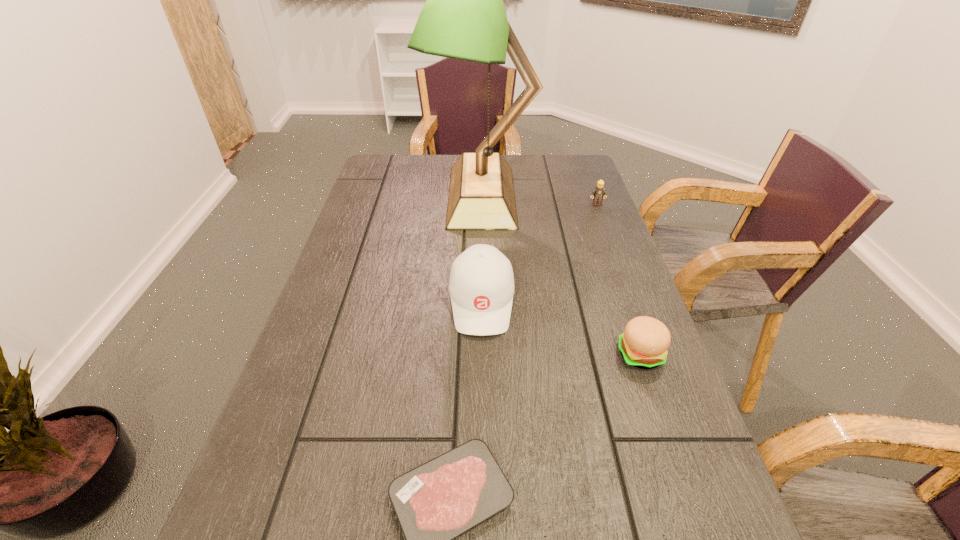
This screenshot has height=540, width=960. Identify the location of table lamp. (464, 17).

Where is `baseball cap`? The image size is (960, 540). baseball cap is located at coordinates (481, 286).

At what (x,y) coordinates should I click in order to perform the action: click on hamburger. Please return your answer as a coordinate pair (x, y). The height and width of the screenshot is (540, 960). Looking at the image, I should click on (643, 344).

At what (x,y) coordinates should I click in order to perform the action: click on Lego. Please return your answer as a coordinate pair (x, y). Image resolution: width=960 pixels, height=540 pixels. Looking at the image, I should click on (599, 192).

The image size is (960, 540). I want to click on blank space located on the metallic stand of the tallest object, so click(382, 197).

Locate an element on the screen. The height and width of the screenshot is (540, 960). free space located 0.180m on the metallic stand of the tallest object is located at coordinates coord(372,197).

You are a GUI agent. You are given a task and a screenshot of the screen. Output one action in this format:
    pyautogui.click(x=<x>, y=<y>)
    Task: Click on the vacant area situated 0.110m on the metallic stand of the tallest object
    This screenshot has height=540, width=960.
    Given the screenshot: What is the action you would take?
    pyautogui.click(x=395, y=197)

You are a GUI agent. You are given a task and a screenshot of the screen. Output one action in this format:
    pyautogui.click(x=<x>, y=<y>)
    Task: Click on the vacant area situated 0.380m on the front-facing side of the baseball cap
    
    Given the screenshot: What is the action you would take?
    pyautogui.click(x=483, y=533)

Where is `vacant space located 0.130m on the left of the hamburger`? The height and width of the screenshot is (540, 960). vacant space located 0.130m on the left of the hamburger is located at coordinates (555, 355).

Identify the location of vacant position located 0.320m in front of the Lego. This screenshot has width=960, height=540. (623, 274).